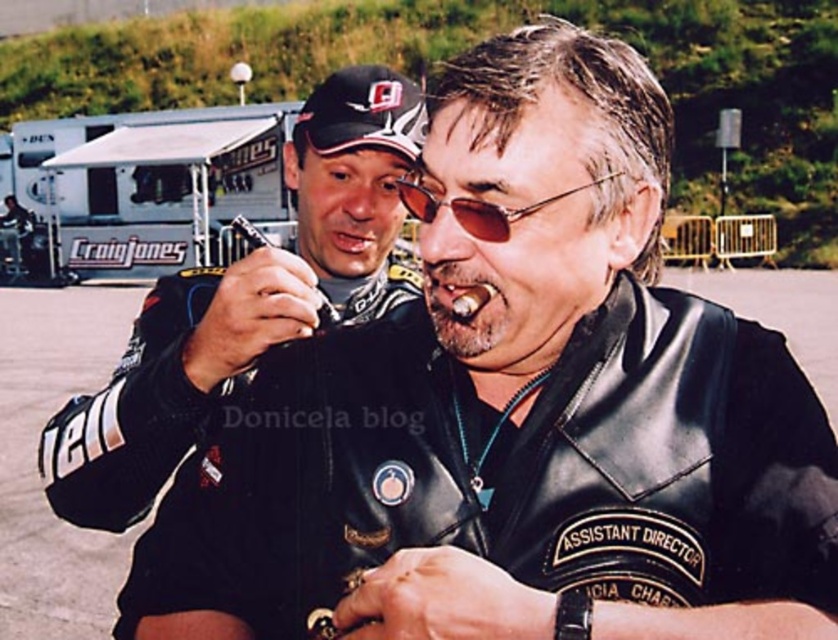
You are a production assistant on set and need to locate the Craig Jones trailer. You see the black leather jacket at center and the white canvas trailer at upper left. Which object is closer to you?

The black leather jacket at center is closer to you because it is in front of the white canvas trailer at upper left.

You are standing at the position of the viewer in the image. There is a black fabric baseball cap at upper center. Can you reach it without moving your feet?

The black fabric baseball cap at upper center is 1.56 meters away from the viewer, so you cannot reach it without moving your feet since the distance exceeds typical arm length.

You are a production assistant on set and need to retrieve an item. You see the black fabric baseball cap at upper center and the sunglasses at center. Which item is covering the other?

The black fabric baseball cap at upper center is positioned over the sunglasses at center, so it is covering the sunglasses at center.